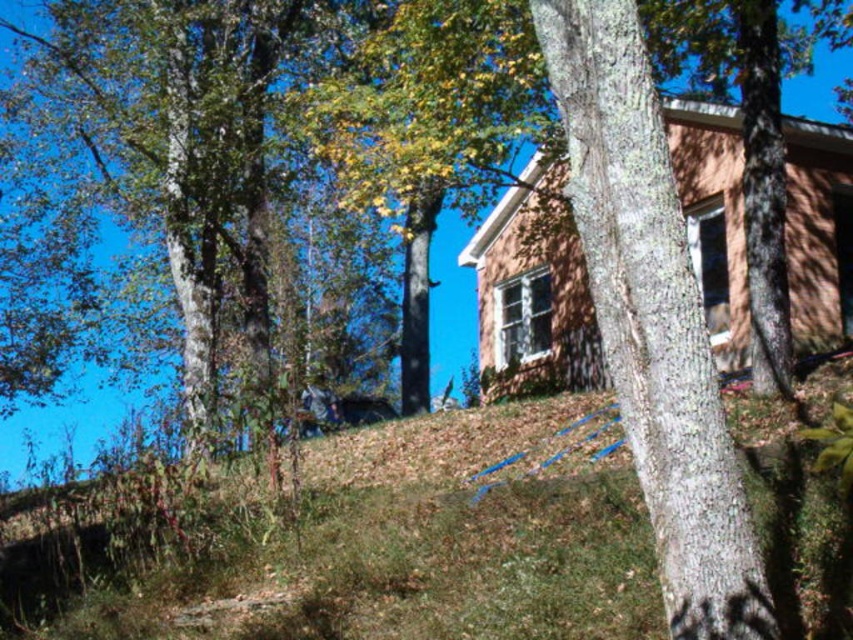
You are planning to build a small garden between the smooth bark tree at center and the rustic wooden cabin at center. Which object should you place the garden closer to in order to ensure there is enough space?

The smooth bark tree at center has a smaller size compared to rustic wooden cabin at center, so you should place the garden closer to the rustic wooden cabin at center to ensure there is enough space.

You are standing on the lawn and want to take a photo of both the smooth bark tree at center and the rustic wooden cabin at center. Which object should you position closer to the camera to ensure both are fully visible in the frame?

The smooth bark tree at center is shorter than the rustic wooden cabin at center, so you should position the camera closer to the cabin to include both in the frame.

You are standing in front of the rustic wooden cabin at center and want to walk towards the smooth bark tree at center. Which direction should you move relative to the cabin?

You should move to the left relative to the rustic wooden cabin at center because the smooth bark tree at center is located to the left of it.